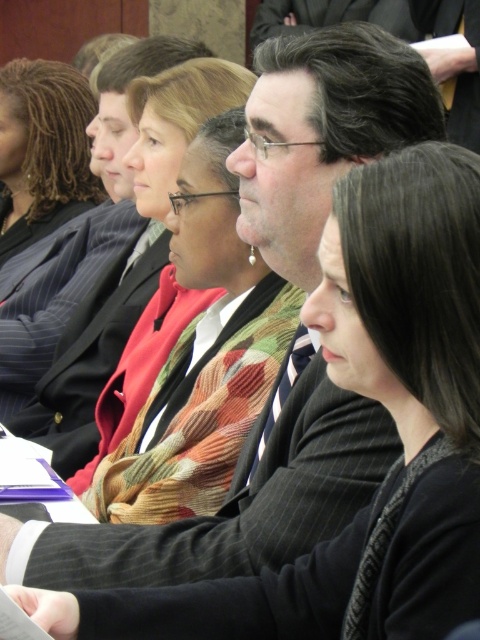
You are attending a professional event and notice a specific point at coordinates [202,355] in the image. Based on the scene description, which object is located at that point?

The point at coordinates [202,355] is located on the knitted scarf at center.

You are organizing a charity event and need to decide which item to display first between the knitted scarf at center and the matte black suit at upper left. Based on their sizes, which one should be placed in a smaller display case?

The knitted scarf at center has a lesser width compared to the matte black suit at upper left, so it should be placed in the smaller display case.

You are an attendee in the conference room and want to determine which of the two points, point [195,426] or point [55,77], is nearer to you. Based on the scene, which point is closer?

Point [195,426] is closer to the viewer than point [55,77].